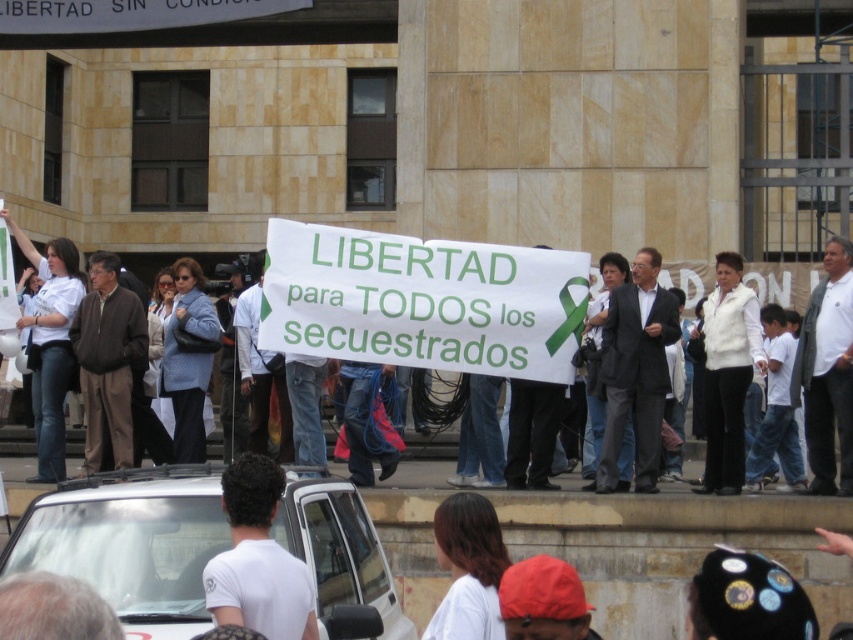
Question: Considering the relative positions of white matte car at center and white t-shirt at lower center in the image provided, where is white matte car at center located with respect to white t-shirt at lower center?

Choices:
 (A) left
 (B) right

Answer: (A)

Question: Does white matte car at center appear over white t-shirt at lower center?

Choices:
 (A) no
 (B) yes

Answer: (B)

Question: Which object is farther from the camera taking this photo?

Choices:
 (A) white t-shirt at lower center
 (B) white matte car at center

Answer: (B)

Question: Which point is closer to the camera taking this photo?

Choices:
 (A) (276, 525)
 (B) (224, 500)

Answer: (B)

Question: Observing the image, what is the correct spatial positioning of white matte car at center in reference to white t-shirt at lower center?

Choices:
 (A) left
 (B) right

Answer: (A)

Question: Which point is farther to the camera?

Choices:
 (A) (318, 620)
 (B) (231, 467)

Answer: (B)